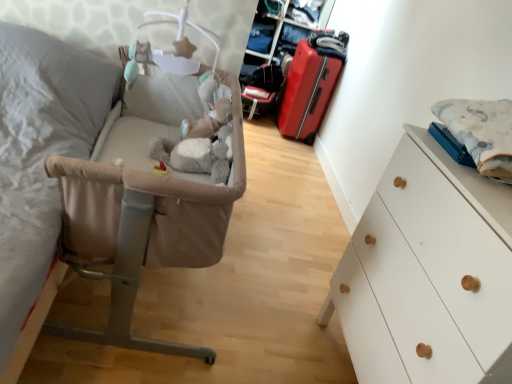
Question: From the image's perspective, is fluffy white blanket at right beneath matte red suitcase at center-right?

Choices:
 (A) yes
 (B) no

Answer: (A)

Question: Is fluffy white blanket at right taller than matte red suitcase at center-right?

Choices:
 (A) yes
 (B) no

Answer: (B)

Question: Is fluffy white blanket at right smaller than matte red suitcase at center-right?

Choices:
 (A) yes
 (B) no

Answer: (A)

Question: Is fluffy white blanket at right far from matte red suitcase at center-right?

Choices:
 (A) no
 (B) yes

Answer: (B)

Question: Considering the relative positions of fluffy white blanket at right and matte red suitcase at center-right in the image provided, is fluffy white blanket at right to the left of matte red suitcase at center-right from the viewer's perspective?

Choices:
 (A) no
 (B) yes

Answer: (A)

Question: From a real-world perspective, is fluffy white blanket at right below matte red suitcase at center-right?

Choices:
 (A) no
 (B) yes

Answer: (A)

Question: Is fluffy white blanket at right inside white matte chest of drawers at right?

Choices:
 (A) yes
 (B) no

Answer: (B)

Question: Does white matte chest of drawers at right have a larger size compared to fluffy white blanket at right?

Choices:
 (A) yes
 (B) no

Answer: (A)

Question: Is white matte chest of drawers at right at the left side of fluffy white blanket at right?

Choices:
 (A) yes
 (B) no

Answer: (A)

Question: Considering the relative sizes of white matte chest of drawers at right and fluffy white blanket at right in the image provided, is white matte chest of drawers at right smaller than fluffy white blanket at right?

Choices:
 (A) yes
 (B) no

Answer: (B)

Question: Does white matte chest of drawers at right have a greater height compared to fluffy white blanket at right?

Choices:
 (A) yes
 (B) no

Answer: (A)

Question: Is white matte chest of drawers at right directly adjacent to fluffy white blanket at right?

Choices:
 (A) no
 (B) yes

Answer: (A)

Question: Is beige fabric infant bed at left positioned with its back to fluffy white blanket at right?

Choices:
 (A) no
 (B) yes

Answer: (A)